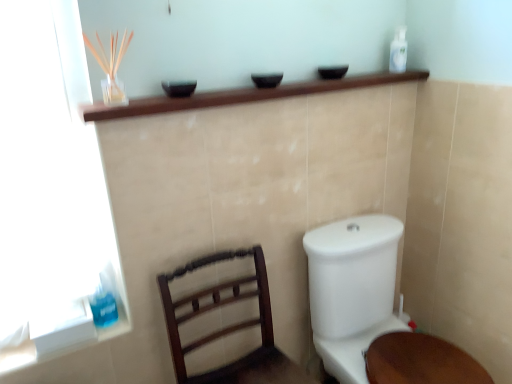
Find the location of a particular element. Image resolution: width=512 pixels, height=384 pixels. blue translucent liquid at lower left, the 2th toiletry viewed from the back is located at coordinates (103, 307).

Describe the element at coordinates (103, 307) in the screenshot. This screenshot has height=384, width=512. I see `blue translucent liquid at lower left, the 2th toiletry viewed from the back` at that location.

What do you see at coordinates (353, 290) in the screenshot? I see `white glossy toilet at lower right` at bounding box center [353, 290].

What do you see at coordinates (230, 327) in the screenshot? I see `dark wood chair at lower left` at bounding box center [230, 327].

Where is `blue translucent liquid at lower left, placed as the 1th toiletry when sorted from left to right`? This screenshot has width=512, height=384. blue translucent liquid at lower left, placed as the 1th toiletry when sorted from left to right is located at coordinates (103, 307).

Does blue translucent liquid at lower left, which appears as the 1th toiletry when viewed from the front, touch dark wood chair at lower left?

blue translucent liquid at lower left, which appears as the 1th toiletry when viewed from the front, is not next to dark wood chair at lower left, and they're not touching.

Considering the sizes of blue translucent liquid at lower left, the second toiletry viewed from the top, and dark wood chair at lower left in the image, is blue translucent liquid at lower left, the second toiletry viewed from the top, taller or shorter than dark wood chair at lower left?

Clearly, blue translucent liquid at lower left, the second toiletry viewed from the top, is shorter compared to dark wood chair at lower left.

Is blue translucent liquid at lower left, which appears as the 2th toiletry when viewed from the right, to the left or to the right of dark wood chair at lower left in the image?

blue translucent liquid at lower left, which appears as the 2th toiletry when viewed from the right, is positioned on dark wood chair at lower left's left side.

Is point (102, 285) more distant than point (177, 270)?

Yes.

Considering the relative positions of dark wood chair at lower left and blue translucent liquid at lower left, the 2th toiletry viewed from the back, in the image provided, is dark wood chair at lower left to the left or to the right of blue translucent liquid at lower left, the 2th toiletry viewed from the back,?

dark wood chair at lower left is positioned on blue translucent liquid at lower left, the 2th toiletry viewed from the back,'s right side.

Which point is more forward, (195, 305) or (91, 307)?

The point (91, 307) is in front.

The image size is (512, 384). In order to click on the 1st toiletry above the dark wood chair at lower left (from the image's perspective) in this screenshot , I will do `click(103, 307)`.

From a real-world perspective, which is physically above, dark wood chair at lower left or blue translucent liquid at lower left, the 2th toiletry viewed from the back?

blue translucent liquid at lower left, the 2th toiletry viewed from the back, from a real-world perspective.

Considering the sizes of objects white glossy toilet at lower right and dark wood chair at lower left in the image provided, who is wider, white glossy toilet at lower right or dark wood chair at lower left?

Wider between the two is white glossy toilet at lower right.

Considering the positions of points (323, 356) and (240, 328), is point (323, 356) farther from camera compared to point (240, 328)?

Yes, it is.

Can you confirm if white glossy toilet at lower right is shorter than dark wood chair at lower left?

No, white glossy toilet at lower right is not shorter than dark wood chair at lower left.

Locate an element on the screen. The image size is (512, 384). toilet on the right of blue translucent liquid at lower left, which appears as the 2th toiletry when viewed from the right is located at coordinates (353, 290).

Is blue translucent liquid at lower left, which appears as the 1th toiletry when viewed from the front, not near white glossy toilet at lower right?

That's not correct — blue translucent liquid at lower left, which appears as the 1th toiletry when viewed from the front, is a little close to white glossy toilet at lower right.

From the image's perspective, which one is positioned higher, blue translucent liquid at lower left, the second toiletry viewed from the top, or white glossy toilet at lower right?

blue translucent liquid at lower left, the second toiletry viewed from the top, from the image's perspective.

Looking at this image, from a real-world perspective, does blue translucent liquid at lower left, which is the 1th toiletry in bottom-to-top order, sit lower than white glossy toilet at lower right?

No, from a real-world perspective, blue translucent liquid at lower left, which is the 1th toiletry in bottom-to-top order, is not below white glossy toilet at lower right.

Measure the distance between white plastic bottle at upper right, which is the first toiletry from back to front, and dark wood chair at lower left.

white plastic bottle at upper right, which is the first toiletry from back to front, is 1.19 meters from dark wood chair at lower left.

From the image's perspective, is white plastic bottle at upper right, the second toiletry ordered from the bottom, below dark wood chair at lower left?

No.

Where is `toiletry that is the 2nd one when counting upward from the dark wood chair at lower left (from the image's perspective)`? This screenshot has width=512, height=384. toiletry that is the 2nd one when counting upward from the dark wood chair at lower left (from the image's perspective) is located at coordinates (398, 51).

Does white plastic bottle at upper right, the 1th toiletry viewed from the top, come in front of white glossy toilet at lower right?

No.

Between white plastic bottle at upper right, the second toiletry from the left, and white glossy toilet at lower right, which one appears on the left side from the viewer's perspective?

From the viewer's perspective, white glossy toilet at lower right appears more on the left side.

Could white glossy toilet at lower right be considered to be inside white plastic bottle at upper right, the second toiletry ordered from the bottom?

No, white glossy toilet at lower right is not inside white plastic bottle at upper right, the second toiletry ordered from the bottom.

Looking at this image, from the image's perspective, is white plastic bottle at upper right, the second toiletry ordered from the bottom, under white glossy toilet at lower right?

No, from the image's perspective, white plastic bottle at upper right, the second toiletry ordered from the bottom, is not beneath white glossy toilet at lower right.

Are white glossy toilet at lower right and white plastic bottle at upper right, the second toiletry from the left, far apart?

They are positioned close to each other.

Is white glossy toilet at lower right wider or thinner than white plastic bottle at upper right, which appears as the 1th toiletry when viewed from the right?

Considering their sizes, white glossy toilet at lower right looks broader than white plastic bottle at upper right, which appears as the 1th toiletry when viewed from the right.

Between white glossy toilet at lower right and white plastic bottle at upper right, which appears as the 1th toiletry when viewed from the right, which one appears on the right side from the viewer's perspective?

white plastic bottle at upper right, which appears as the 1th toiletry when viewed from the right, is more to the right.

Does point (317, 348) come farther from viewer compared to point (399, 40)?

Yes, it is behind point (399, 40).

What are the coordinates of `toiletry on the left of dark wood chair at lower left` in the screenshot? It's located at (103, 307).

Where is `furniture directly beneath the blue translucent liquid at lower left, the second toiletry viewed from the top (from a real-world perspective)`? The height and width of the screenshot is (384, 512). furniture directly beneath the blue translucent liquid at lower left, the second toiletry viewed from the top (from a real-world perspective) is located at coordinates (230, 327).

Estimate the real-world distances between objects in this image. Which object is further from dark wood chair at lower left, white plastic bottle at upper right, the second toiletry ordered from the bottom, or white glossy toilet at lower right?

white plastic bottle at upper right, the second toiletry ordered from the bottom, is further to dark wood chair at lower left.

Which object lies nearer to the anchor point white glossy toilet at lower right, blue translucent liquid at lower left, which appears as the 1th toiletry when viewed from the front, or dark wood chair at lower left?

The object closer to white glossy toilet at lower right is dark wood chair at lower left.

Based on their spatial positions, is dark wood chair at lower left or white plastic bottle at upper right, which appears as the 1th toiletry when viewed from the right, further from blue translucent liquid at lower left, which appears as the 1th toiletry when viewed from the front?

white plastic bottle at upper right, which appears as the 1th toiletry when viewed from the right, is positioned further to the anchor blue translucent liquid at lower left, which appears as the 1th toiletry when viewed from the front.

From the image, which object appears to be farther from blue translucent liquid at lower left, placed as the 1th toiletry when sorted from left to right, white glossy toilet at lower right or dark wood chair at lower left?

white glossy toilet at lower right is further to blue translucent liquid at lower left, placed as the 1th toiletry when sorted from left to right.

Based on the photo, looking at the image, which one is located further to blue translucent liquid at lower left, the second toiletry viewed from the top, white plastic bottle at upper right, which appears as the 1th toiletry when viewed from the right, or dark wood chair at lower left?

The object further to blue translucent liquid at lower left, the second toiletry viewed from the top, is white plastic bottle at upper right, which appears as the 1th toiletry when viewed from the right.

Looking at the image, which one is located closer to dark wood chair at lower left, white glossy toilet at lower right or blue translucent liquid at lower left, which appears as the 1th toiletry when viewed from the front?

Among the two, white glossy toilet at lower right is located nearer to dark wood chair at lower left.

Which object lies nearer to the anchor point white plastic bottle at upper right, the second toiletry from the left, white glossy toilet at lower right or blue translucent liquid at lower left, which appears as the 2th toiletry when viewed from the right?

white glossy toilet at lower right is positioned closer to the anchor white plastic bottle at upper right, the second toiletry from the left.

Estimate the real-world distances between objects in this image. Which object is closer to white glossy toilet at lower right, white plastic bottle at upper right, which appears as the 1th toiletry when viewed from the right, or dark wood chair at lower left?

Among the two, dark wood chair at lower left is located nearer to white glossy toilet at lower right.

Where is `toilet between white plastic bottle at upper right, which appears as the 1th toiletry when viewed from the right, and dark wood chair at lower left from top to bottom`? Image resolution: width=512 pixels, height=384 pixels. toilet between white plastic bottle at upper right, which appears as the 1th toiletry when viewed from the right, and dark wood chair at lower left from top to bottom is located at coordinates (353, 290).

Identify the location of furniture situated between blue translucent liquid at lower left, which appears as the 2th toiletry when viewed from the right, and white glossy toilet at lower right from left to right. (230, 327).

Where is `toiletry that lies between white plastic bottle at upper right, the second toiletry ordered from the bottom, and white glossy toilet at lower right from top to bottom`? The width and height of the screenshot is (512, 384). toiletry that lies between white plastic bottle at upper right, the second toiletry ordered from the bottom, and white glossy toilet at lower right from top to bottom is located at coordinates (103, 307).

You are a GUI agent. You are given a task and a screenshot of the screen. Output one action in this format:
    pyautogui.click(x=<x>, y=<y>)
    Task: Click on the toiletry between white plastic bottle at upper right, which is the first toiletry from back to front, and dark wood chair at lower left vertically
    This screenshot has height=384, width=512.
    Given the screenshot: What is the action you would take?
    pyautogui.click(x=103, y=307)